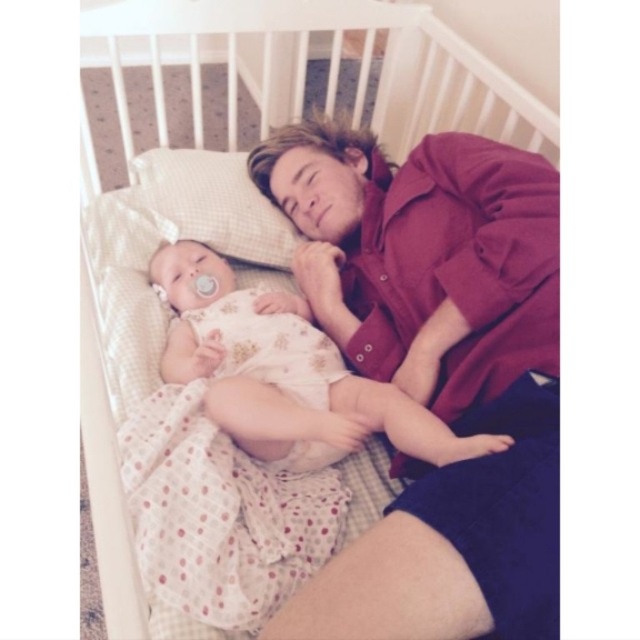
Is floral cotton dress at center further to camera compared to white checkered pillow at upper left?

No.

You are a GUI agent. You are given a task and a screenshot of the screen. Output one action in this format:
    pyautogui.click(x=<x>, y=<y>)
    Task: Click on the floral cotton dress at center
    
    Given the screenshot: What is the action you would take?
    pyautogui.click(x=284, y=372)